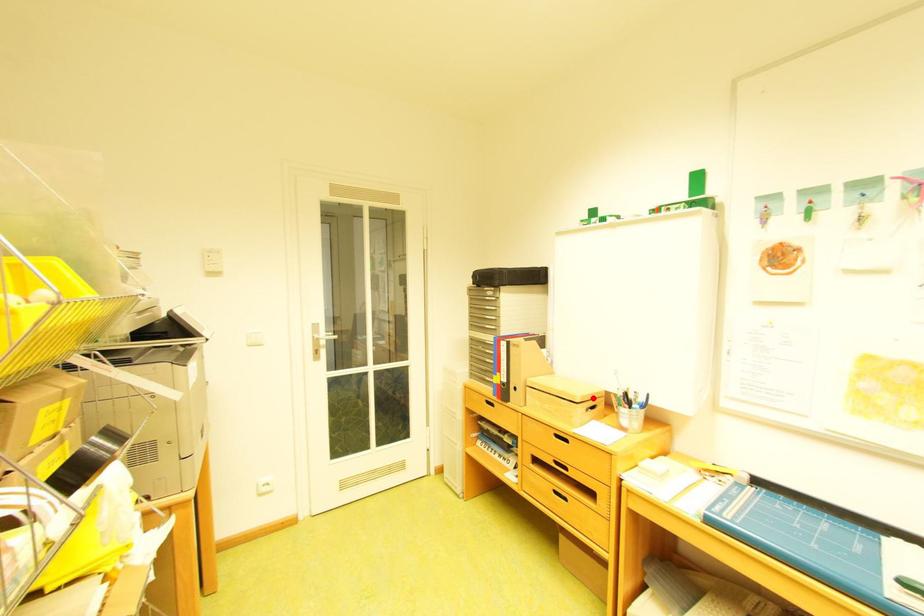
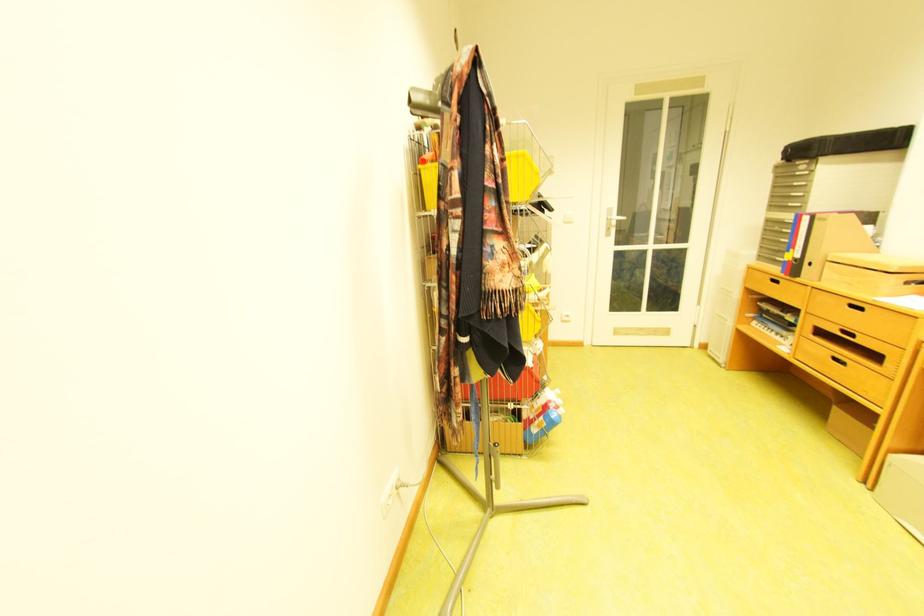
Find the pixel in the second image that matches the highlighted location in the first image.

(910, 268)